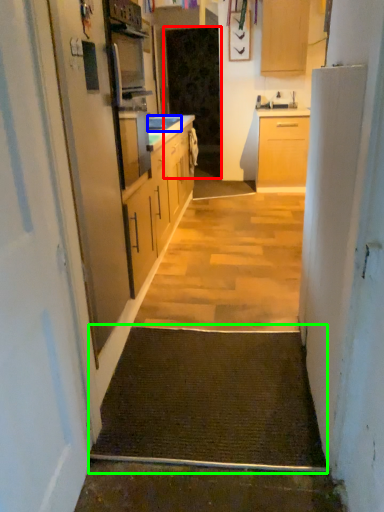
Question: Which object is positioned farthest from screen door (highlighted by a red box)? Select from sink (highlighted by a blue box) and doormat (highlighted by a green box).

Choices:
 (A) sink
 (B) doormat

Answer: (B)